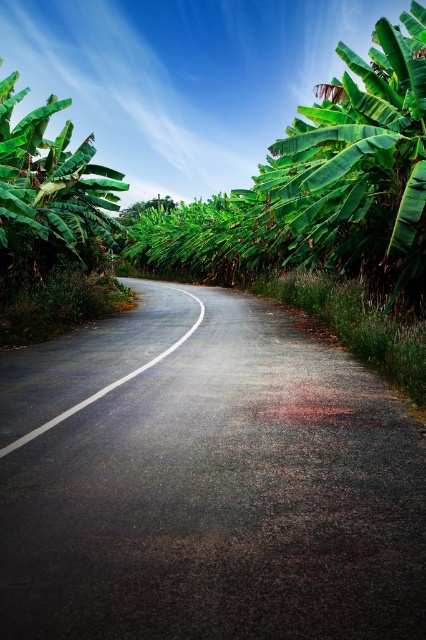
Question: Is green leafy banana tree at left above white asphalt road at center?

Choices:
 (A) yes
 (B) no

Answer: (A)

Question: Estimate the real-world distances between objects in this image. Which object is closer to the green leafy banana tree at left?

Choices:
 (A) green leafy tree at center
 (B) green leafy banana tree at right

Answer: (B)

Question: Is green leafy banana tree at right below green leafy tree at center?

Choices:
 (A) no
 (B) yes

Answer: (B)

Question: Considering the relative positions of green leafy banana tree at right and green leafy tree at center in the image provided, where is green leafy banana tree at right located with respect to green leafy tree at center?

Choices:
 (A) right
 (B) left

Answer: (A)

Question: Which point is farther from the camera taking this photo?

Choices:
 (A) (8, 452)
 (B) (147, 209)

Answer: (B)

Question: Among these objects, which one is farthest from the camera?

Choices:
 (A) green leafy banana tree at left
 (B) white asphalt road at center

Answer: (A)